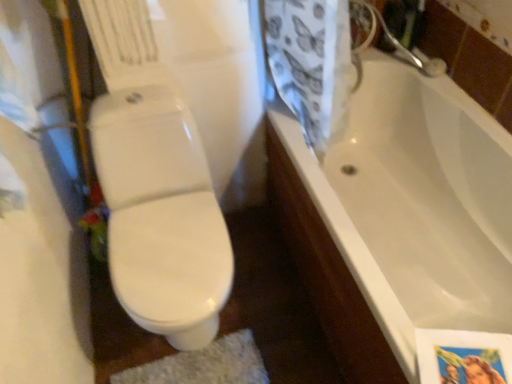
Question: Is white glossy bathtub at right in front of or behind white glossy toilet at center in the image?

Choices:
 (A) behind
 (B) front

Answer: (B)

Question: Is white glossy bathtub at right taller or shorter than white glossy toilet at center?

Choices:
 (A) tall
 (B) short

Answer: (B)

Question: In terms of size, does white glossy bathtub at right appear bigger or smaller than white glossy toilet at center?

Choices:
 (A) small
 (B) big

Answer: (B)

Question: In terms of height, does white glossy toilet at center look taller or shorter compared to white glossy bathtub at right?

Choices:
 (A) tall
 (B) short

Answer: (A)

Question: Is point (134, 148) closer or farther from the camera than point (416, 188)?

Choices:
 (A) closer
 (B) farther

Answer: (A)

Question: From a real-world perspective, is white glossy toilet at center above or below white glossy bathtub at right?

Choices:
 (A) above
 (B) below

Answer: (A)

Question: Considering their positions, is white glossy toilet at center located in front of or behind white glossy bathtub at right?

Choices:
 (A) front
 (B) behind

Answer: (B)